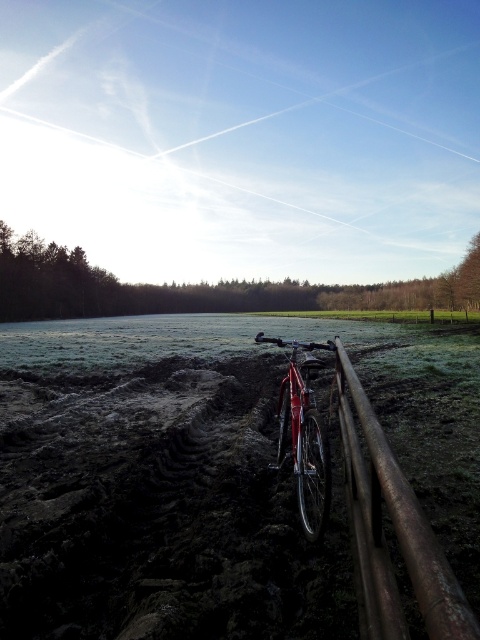
Question: Does rusty metal fence at lower right have a larger size compared to shiny red bicycle at center?

Choices:
 (A) yes
 (B) no

Answer: (B)

Question: Where is rusty metal fence at lower right located in relation to shiny red bicycle at center in the image?

Choices:
 (A) left
 (B) right

Answer: (A)

Question: Which point is closer to the camera?

Choices:
 (A) (373, 556)
 (B) (314, 476)

Answer: (A)

Question: Does rusty metal fence at lower right appear on the left side of shiny red bicycle at center?

Choices:
 (A) no
 (B) yes

Answer: (B)

Question: Which point is farther to the camera?

Choices:
 (A) shiny red bicycle at center
 (B) rusty metal fence at lower right

Answer: (A)